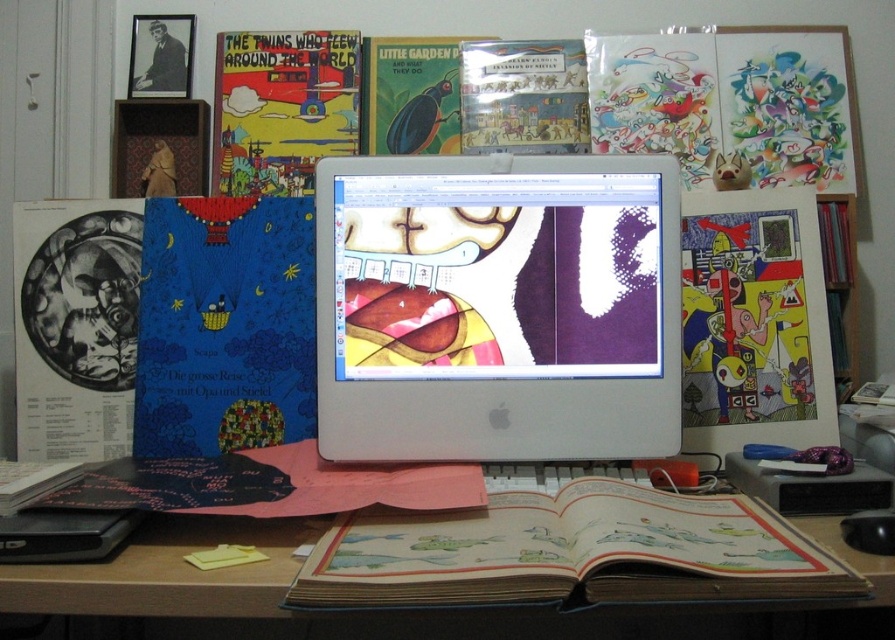
Measure the distance between silver metallic monitor at center and camera.

silver metallic monitor at center and camera are 1.01 meters apart from each other.

Can you confirm if silver metallic monitor at center is wider than matte black book at left?

Yes, silver metallic monitor at center is wider than matte black book at left.

Does point (544, 442) lie behind point (24, 484)?

Yes.

You are a GUI agent. You are given a task and a screenshot of the screen. Output one action in this format:
    pyautogui.click(x=<x>, y=<y>)
    Task: Click on the silver metallic monitor at center
    The image size is (895, 640).
    Given the screenshot: What is the action you would take?
    pyautogui.click(x=497, y=307)

Who is lower down, wooden desk at center or matte paper comic book at upper left?

Positioned lower is wooden desk at center.

Who is shorter, wooden desk at center or matte paper comic book at upper left?

With less height is wooden desk at center.

Which is in front, point (175, 544) or point (304, 148)?

Point (175, 544) is more forward.

Where is `wooden desk at center`? wooden desk at center is located at coordinates (169, 573).

The height and width of the screenshot is (640, 895). Find the location of `silver metallic monitor at center`. silver metallic monitor at center is located at coordinates [x=497, y=307].

Is silver metallic monitor at center taller than blue matte book at left?

Correct, silver metallic monitor at center is much taller as blue matte book at left.

Identify the location of silver metallic monitor at center. (497, 307).

The image size is (895, 640). Identify the location of silver metallic monitor at center. [497, 307].